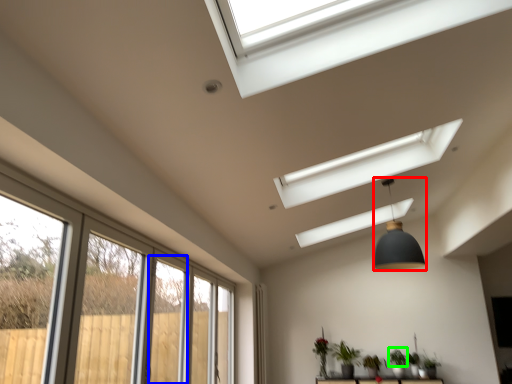
Question: Estimate the real-world distances between objects in this image. Which object is farther from light fixture (highlighted by a red box), screen door (highlighted by a blue box) or plant (highlighted by a green box)?

Choices:
 (A) screen door
 (B) plant

Answer: (B)